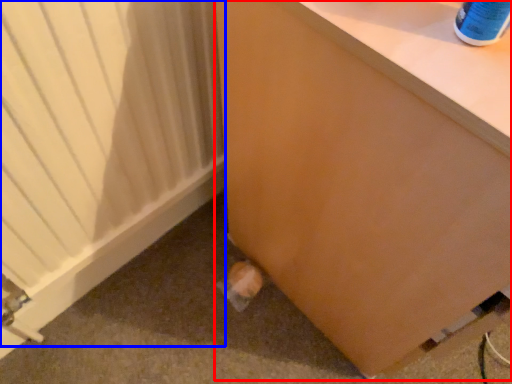
Question: Which object is closer to the camera taking this photo, furniture (highlighted by a red box) or heater (highlighted by a blue box)?

Choices:
 (A) furniture
 (B) heater

Answer: (A)